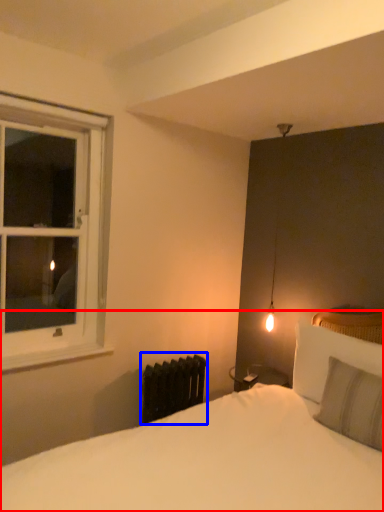
Question: Among these objects, which one is nearest to the camera, bed (highlighted by a red box) or radiator (highlighted by a blue box)?

Choices:
 (A) bed
 (B) radiator

Answer: (A)